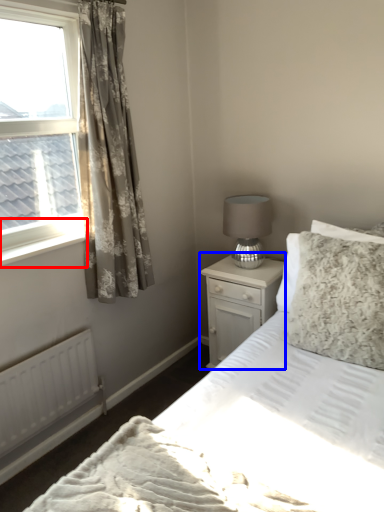
Question: Which object appears closest to the camera in this image, window sill (highlighted by a red box) or nightstand (highlighted by a blue box)?

Choices:
 (A) window sill
 (B) nightstand

Answer: (A)